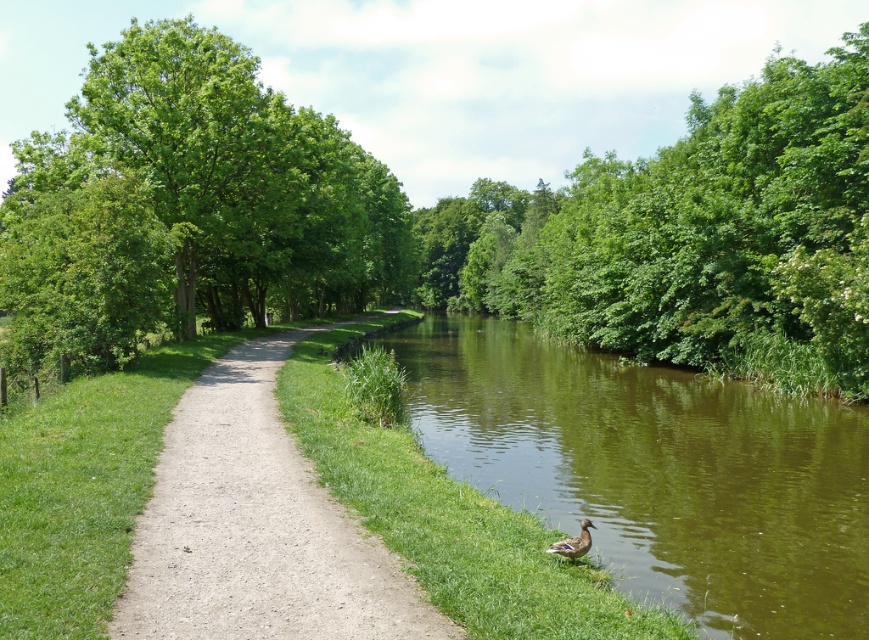
Is green grassy river at center wider than brown fuzzy duck at lower center?

Correct, the width of green grassy river at center exceeds that of brown fuzzy duck at lower center.

Is green grassy river at center taller than brown fuzzy duck at lower center?

Yes, green grassy river at center is taller than brown fuzzy duck at lower center.

Image resolution: width=869 pixels, height=640 pixels. What do you see at coordinates (657, 472) in the screenshot? I see `green grassy river at center` at bounding box center [657, 472].

Locate an element on the screen. green grassy river at center is located at coordinates (657, 472).

Is green grassy river at center shorter than dirt path at center?

Incorrect, green grassy river at center's height does not fall short of dirt path at center's.

You are a GUI agent. You are given a task and a screenshot of the screen. Output one action in this format:
    pyautogui.click(x=<x>, y=<y>)
    Task: Click on the green grassy river at center
    The height and width of the screenshot is (640, 869).
    Given the screenshot: What is the action you would take?
    pyautogui.click(x=657, y=472)

What are the coordinates of `green grassy river at center` in the screenshot? It's located at (657, 472).

Is point (168, 448) more distant than point (569, 541)?

Yes, it is.

Between point (133, 624) and point (587, 522), which one is positioned behind?

Positioned behind is point (587, 522).

Between point (206, 452) and point (578, 545), which one is positioned in front?

Point (578, 545) is in front.

This screenshot has width=869, height=640. Find the location of `dirt path at center`. dirt path at center is located at coordinates (256, 528).